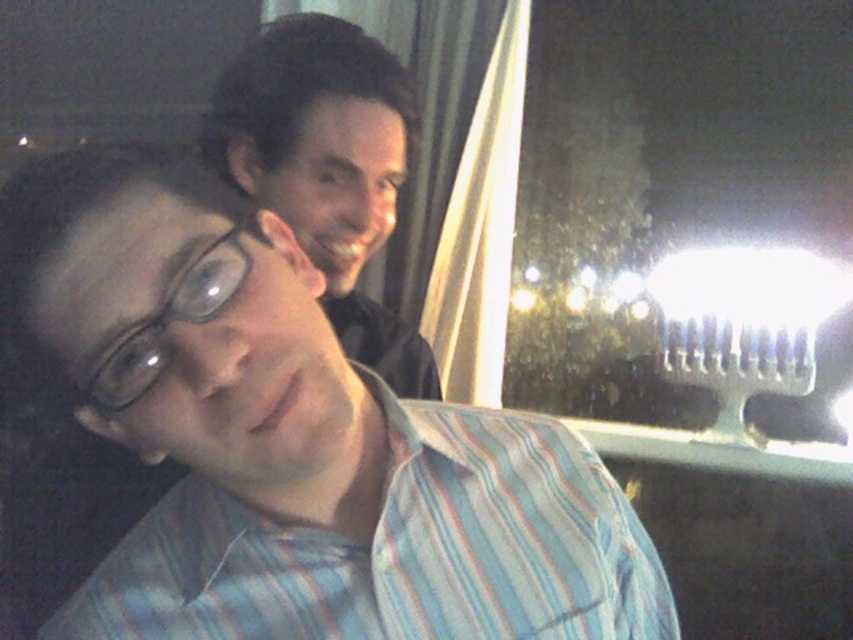
Based on the photo, which of these two, striped cotton shirt at center or transparent plastic glasses at upper left, stands taller?

striped cotton shirt at center is taller.

Is striped cotton shirt at center below transparent plastic glasses at upper left?

Correct, striped cotton shirt at center is located below transparent plastic glasses at upper left.

Who is more forward, (419, 541) or (190, 262)?

Point (190, 262)

The width and height of the screenshot is (853, 640). In order to click on striped cotton shirt at center in this screenshot , I will do `click(398, 548)`.

This screenshot has height=640, width=853. What are the coordinates of `matte black shirt at upper center` in the screenshot? It's located at (328, 168).

Which is behind, point (235, 138) or point (106, 403)?

Positioned behind is point (235, 138).

The width and height of the screenshot is (853, 640). Find the location of `matte black shirt at upper center`. matte black shirt at upper center is located at coordinates (328, 168).

Is point (166, 586) closer to camera compared to point (416, 362)?

Yes, it is in front of point (416, 362).

Is striped cotton shirt at center taller than matte black shirt at upper center?

No, striped cotton shirt at center is not taller than matte black shirt at upper center.

Does point (595, 634) come farther from viewer compared to point (349, 58)?

No, (595, 634) is closer to viewer.

Image resolution: width=853 pixels, height=640 pixels. In order to click on striped cotton shirt at center in this screenshot , I will do `click(398, 548)`.